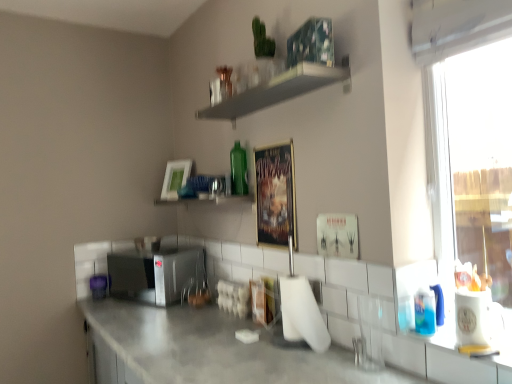
Question: Could white matte shelf at upper center, the 1th shelf when ordered from top to bottom, be considered to be inside metallic poster at center, the 2th picture frame when ordered from left to right?

Choices:
 (A) no
 (B) yes

Answer: (A)

Question: Is white matte shelf at upper center, the 1th shelf when ordered from top to bottom, at the back of metallic poster at center, the 2th picture frame when ordered from left to right?

Choices:
 (A) yes
 (B) no

Answer: (B)

Question: Does metallic poster at center, the 1th picture frame from the front, have a larger size compared to white matte shelf at upper center, the second shelf when ordered from bottom to top?

Choices:
 (A) no
 (B) yes

Answer: (A)

Question: Considering the relative sizes of metallic poster at center, the 2th picture frame when ordered from left to right, and white matte shelf at upper center, the 1th shelf when ordered from top to bottom, in the image provided, is metallic poster at center, the 2th picture frame when ordered from left to right, wider than white matte shelf at upper center, the 1th shelf when ordered from top to bottom,?

Choices:
 (A) no
 (B) yes

Answer: (A)

Question: Does metallic poster at center, the 2th picture frame when ordered from left to right, have a smaller size compared to white matte shelf at upper center, the second shelf when ordered from bottom to top?

Choices:
 (A) yes
 (B) no

Answer: (A)

Question: Relative to transparent glass window at right, is satin silver microwave at center in front or behind?

Choices:
 (A) front
 (B) behind

Answer: (B)

Question: From a real-world perspective, is satin silver microwave at center above or below transparent glass window at right?

Choices:
 (A) below
 (B) above

Answer: (A)

Question: Is satin silver microwave at center situated inside transparent glass window at right or outside?

Choices:
 (A) inside
 (B) outside

Answer: (B)

Question: Considering the positions of satin silver microwave at center and transparent glass window at right in the image, is satin silver microwave at center taller or shorter than transparent glass window at right?

Choices:
 (A) short
 (B) tall

Answer: (A)

Question: Relative to transparent glass window at right, is metallic poster at center, the 2th picture frame when ordered from left to right, in front or behind?

Choices:
 (A) front
 (B) behind

Answer: (B)

Question: Considering the relative positions of metallic poster at center, arranged as the 1th picture frame when viewed from the right, and transparent glass window at right in the image provided, is metallic poster at center, arranged as the 1th picture frame when viewed from the right, to the left or to the right of transparent glass window at right?

Choices:
 (A) right
 (B) left

Answer: (B)

Question: Considering the positions of metallic poster at center, the 1th picture frame from the front, and transparent glass window at right in the image, is metallic poster at center, the 1th picture frame from the front, taller or shorter than transparent glass window at right?

Choices:
 (A) short
 (B) tall

Answer: (A)

Question: Is metallic poster at center, the 1th picture frame from the front, inside the boundaries of transparent glass window at right, or outside?

Choices:
 (A) outside
 (B) inside

Answer: (A)

Question: Considering the relative positions of transparent glass window at right and green glass bottle at upper center in the image provided, is transparent glass window at right to the left or to the right of green glass bottle at upper center?

Choices:
 (A) right
 (B) left

Answer: (A)

Question: Is transparent glass window at right taller or shorter than green glass bottle at upper center?

Choices:
 (A) short
 (B) tall

Answer: (B)